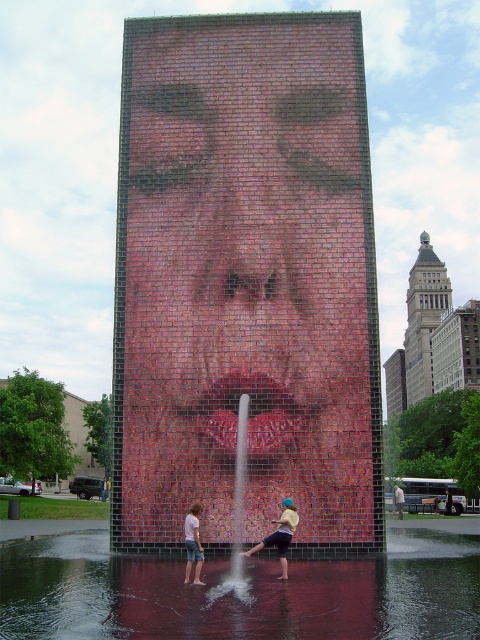
You are standing in front of the public art installation and want to take a photo of the clear water at center. Where should you position yourself to capture the water in the center of your photo?

You should position yourself directly in front of the clear water at center at point (240, 593) to ensure it is centered in your photo.

You are a photographer standing in front of the public art installation. You notice two people wearing a yellow cotton shirt at center and denim shorts at lower center. Which clothing item is shorter in height?

The yellow cotton shirt at center has a lesser height compared to denim shorts at lower center, so the yellow cotton shirt at center is shorter in height.

You are a photographer trying to capture the art installation and the people in front of it. You want to ensure both the yellow cotton shirt at center and the denim shorts at lower center are clearly visible in your photo. Given their sizes, which object should you focus on to ensure both are in frame without needing to adjust your camera angle?

The yellow cotton shirt at center is bigger than denim shorts at lower center. Focus on the yellow cotton shirt at center to ensure both are in frame since it is larger and will help maintain visibility of the smaller denim shorts at lower center.